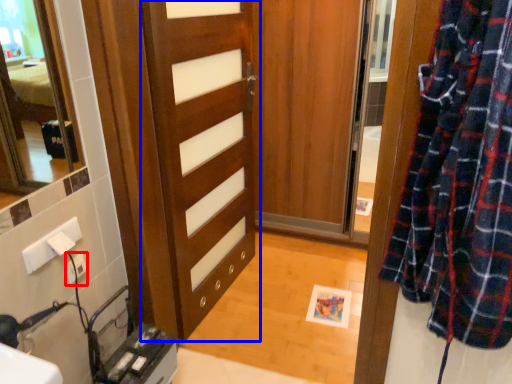
Question: Which point is closer to the camera, electric outlet (highlighted by a red box) or door (highlighted by a blue box)?

Choices:
 (A) electric outlet
 (B) door

Answer: (B)